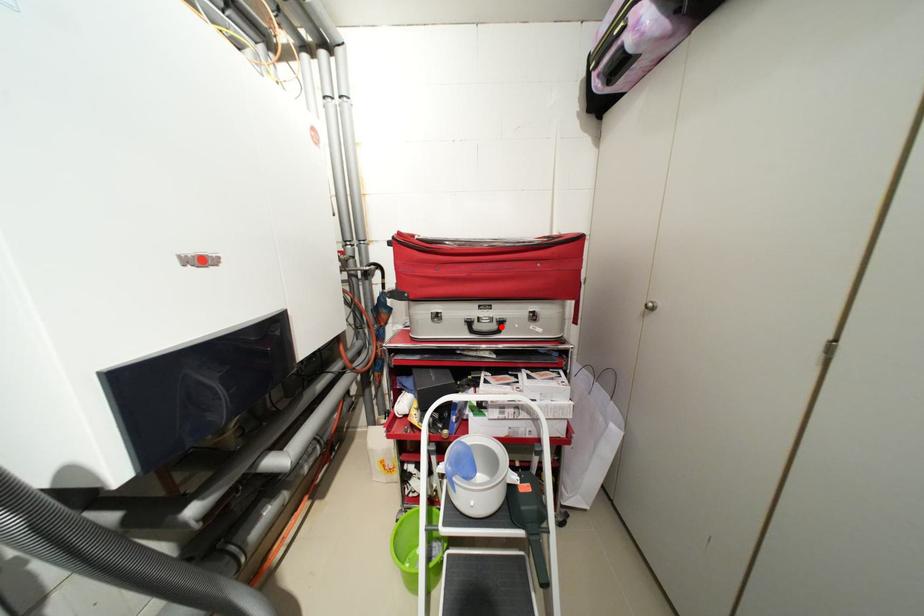
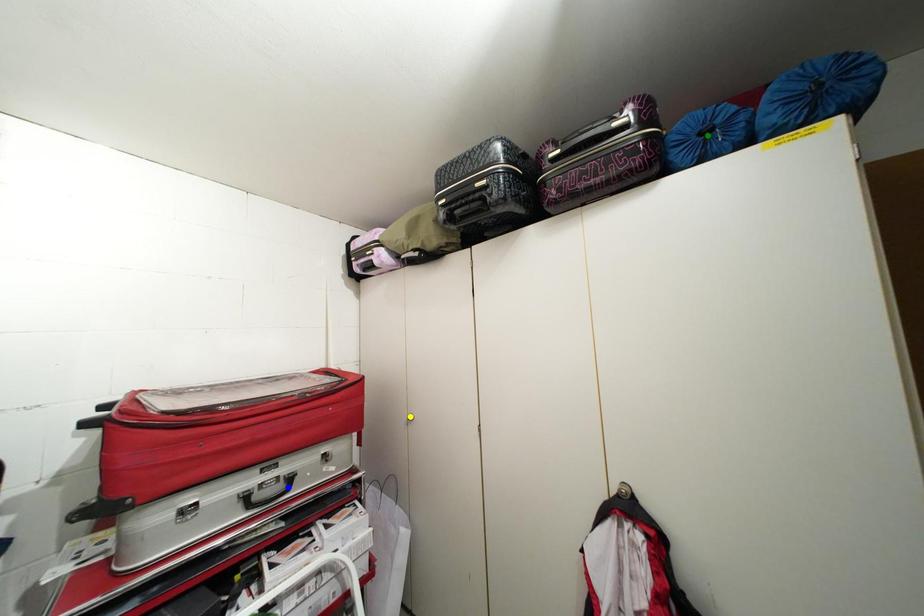
Question: I am providing you with two images of the same scene from different viewpoints. A red point is marked on the first image. You are given multiple points on the second image. In image 2, which mark is for the same physical point as the one in image 1?

Choices:
 (A) yellow point
 (B) blue point
 (C) green point

Answer: (B)